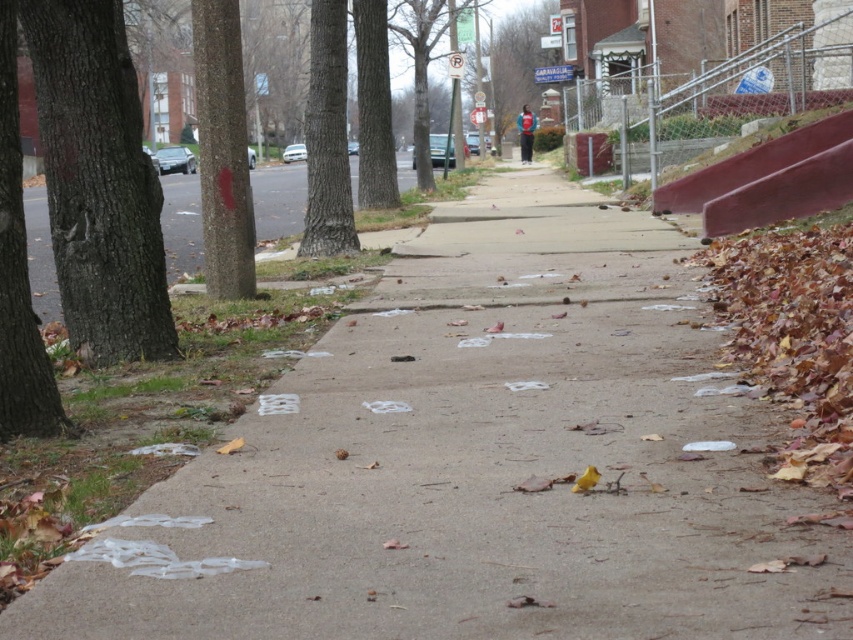
Question: Which is nearer to the brown rough bark tree at left?

Choices:
 (A) brown rough tree at left
 (B) smooth gray tree trunk at left

Answer: (A)

Question: Is smooth bark tree at center to the right of green rough bark tree at center from the viewer's perspective?

Choices:
 (A) no
 (B) yes

Answer: (A)

Question: Does smooth gray tree trunk at left have a greater width compared to green rough bark tree at center?

Choices:
 (A) yes
 (B) no

Answer: (A)

Question: Is brown rough bark tree at left behind brown rough tree at left?

Choices:
 (A) yes
 (B) no

Answer: (A)

Question: Among these points, which one is nearest to the camera?

Choices:
 (A) (105, 97)
 (B) (341, 173)

Answer: (A)

Question: Which object is farther from the camera taking this photo?

Choices:
 (A) smooth red concrete stairs at right
 (B) brown rough tree at left
 (C) smooth gray tree trunk at left
 (D) smooth bark tree at center

Answer: (A)